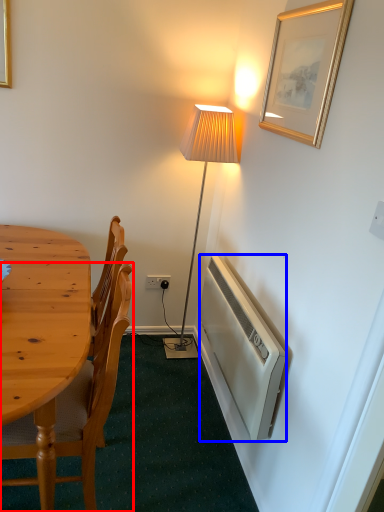
Question: Among these objects, which one is nearest to the camera, chair (highlighted by a red box) or radiator (highlighted by a blue box)?

Choices:
 (A) chair
 (B) radiator

Answer: (A)